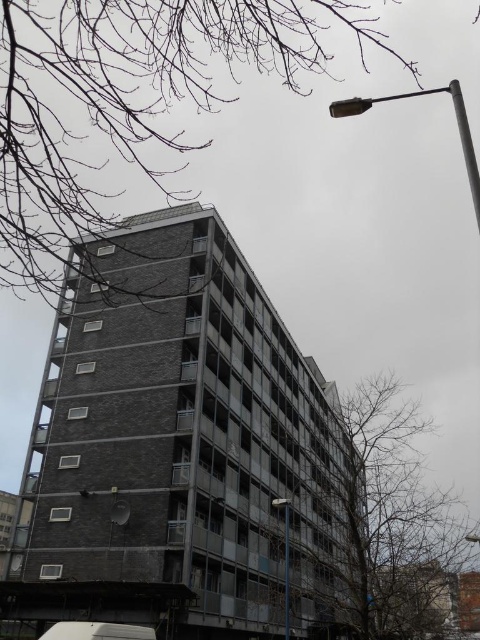
You are a window cleaner who needs to reach the highest point of both the metallic pole at upper right and the metallic pole at center. Which pole will require you to climb higher to reach its top?

The metallic pole at upper right has a greater height compared to metallic pole at center, so you will need to climb higher to reach the top of the metallic pole at upper right.